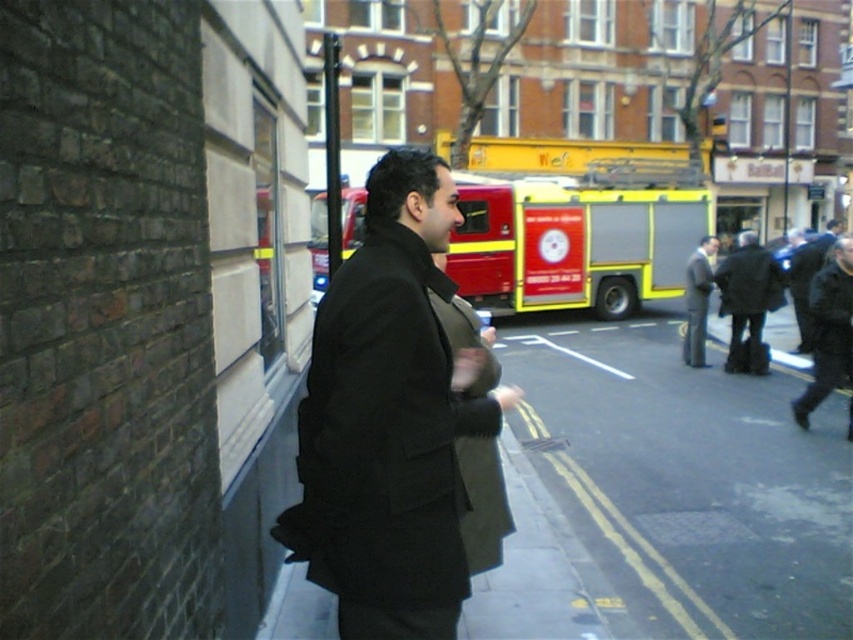
Question: Does dark gray coat at right have a greater width compared to dark brown leather jacket at center?

Choices:
 (A) yes
 (B) no

Answer: (B)

Question: Among these points, which one is farthest from the camera?

Choices:
 (A) (805, 348)
 (B) (618, 196)
 (C) (548, 337)
 (D) (746, 323)

Answer: (B)

Question: Which is nearer to the dark gray jacket at center?

Choices:
 (A) red/yellow fire truck at center
 (B) dark wool coat at center

Answer: (B)

Question: Is matte black coat at center wider than dark brown leather jacket at center?

Choices:
 (A) yes
 (B) no

Answer: (A)

Question: Which object is farther from the camera taking this photo?

Choices:
 (A) dark wool coat at center
 (B) red/yellow fire truck at center

Answer: (B)

Question: Can you confirm if smooth asphalt road at center is smaller than dark gray coat at right?

Choices:
 (A) yes
 (B) no

Answer: (B)